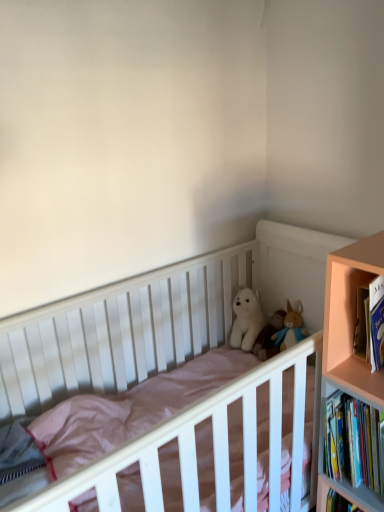
Question: Can you confirm if white plush bear at center, which is the first doll from right to left, is bigger than pink wood bookcase at right?

Choices:
 (A) yes
 (B) no

Answer: (B)

Question: Considering the relative sizes of white plush bear at center, placed as the 2th doll when sorted from left to right, and pink wood bookcase at right in the image provided, is white plush bear at center, placed as the 2th doll when sorted from left to right, thinner than pink wood bookcase at right?

Choices:
 (A) yes
 (B) no

Answer: (A)

Question: Is pink wood bookcase at right inside white plush bear at center, placed as the 2th doll when sorted from left to right?

Choices:
 (A) yes
 (B) no

Answer: (B)

Question: From the image's perspective, would you say white plush bear at center, which is the first doll from right to left, is shown under pink wood bookcase at right?

Choices:
 (A) no
 (B) yes

Answer: (A)

Question: From a real-world perspective, does white plush bear at center, placed as the 2th doll when sorted from left to right, stand above pink wood bookcase at right?

Choices:
 (A) no
 (B) yes

Answer: (A)

Question: In the image, is hardcover books at right positioned in front of or behind pink wood bookcase at right?

Choices:
 (A) behind
 (B) front

Answer: (A)

Question: From their relative heights in the image, would you say hardcover books at right is taller or shorter than pink wood bookcase at right?

Choices:
 (A) tall
 (B) short

Answer: (B)

Question: Based on their positions, is hardcover books at right located to the left or right of pink wood bookcase at right?

Choices:
 (A) left
 (B) right

Answer: (A)

Question: From the image's perspective, is hardcover books at right above or below pink wood bookcase at right?

Choices:
 (A) above
 (B) below

Answer: (A)

Question: Considering the positions of white plush bear at center, the second doll from the right, and white plush toy at center in the image, is white plush bear at center, the second doll from the right, wider or thinner than white plush toy at center?

Choices:
 (A) wide
 (B) thin

Answer: (B)

Question: Is white plush bear at center, the second doll from the right, in front of or behind white plush toy at center in the image?

Choices:
 (A) behind
 (B) front

Answer: (A)

Question: From their relative heights in the image, would you say white plush bear at center, the 1th doll positioned from the left, is taller or shorter than white plush toy at center?

Choices:
 (A) short
 (B) tall

Answer: (B)

Question: Is white plush bear at center, the second doll from the right, bigger or smaller than white plush toy at center?

Choices:
 (A) small
 (B) big

Answer: (A)

Question: Is white plush bear at center, placed as the 2th doll when sorted from left to right, to the left or to the right of pink wood bookcase at right in the image?

Choices:
 (A) right
 (B) left

Answer: (B)

Question: Is white plush bear at center, placed as the 2th doll when sorted from left to right, taller or shorter than pink wood bookcase at right?

Choices:
 (A) tall
 (B) short

Answer: (B)